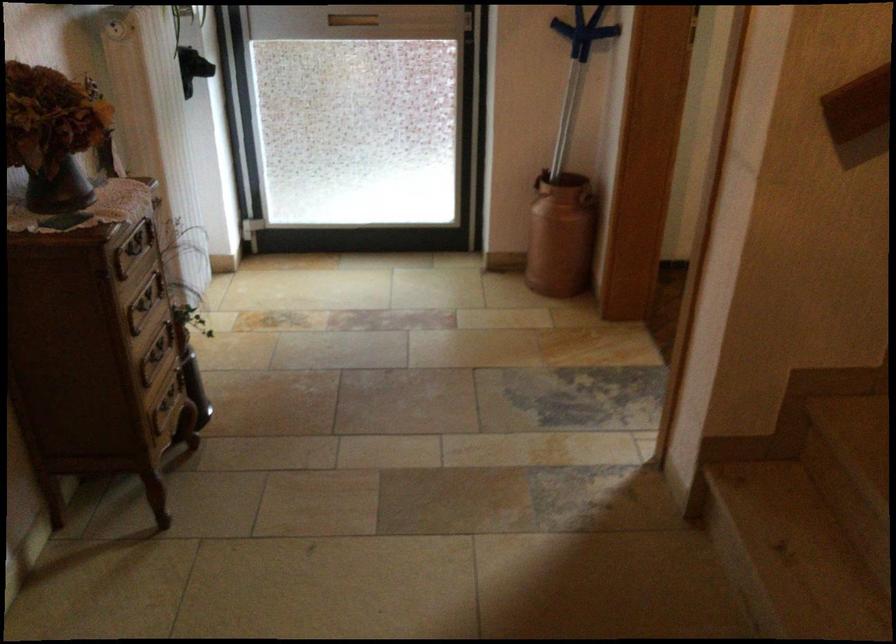
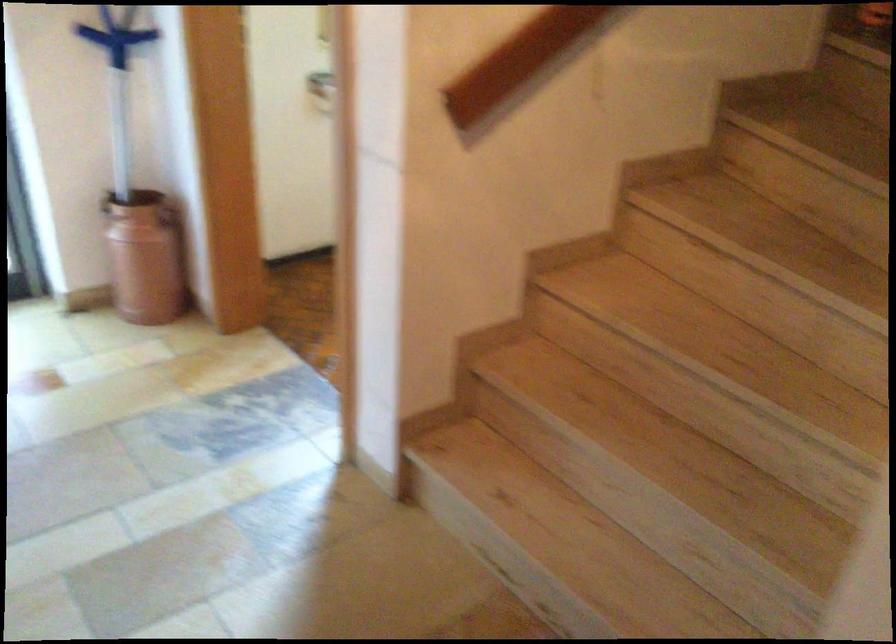
Question: The first image is from the beginning of the video and the second image is from the end. How did the camera likely rotate when shooting the video?

Choices:
 (A) Left
 (B) Right
 (C) Up
 (D) Down

Answer: (B)